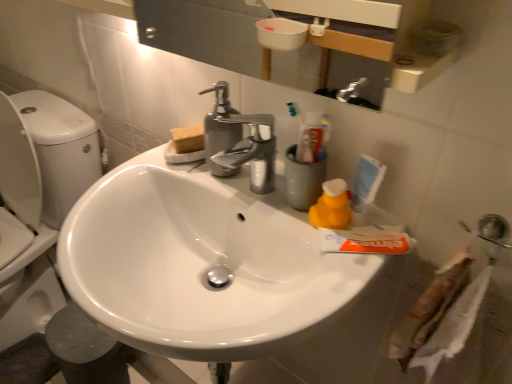
Question: Does white glossy sink at center lie behind yellow rubber duck at right?

Choices:
 (A) no
 (B) yes

Answer: (A)

Question: Does white glossy sink at center appear on the left side of yellow rubber duck at right?

Choices:
 (A) yes
 (B) no

Answer: (A)

Question: Can you confirm if white glossy sink at center is wider than yellow rubber duck at right?

Choices:
 (A) no
 (B) yes

Answer: (B)

Question: Can you confirm if white glossy sink at center is shorter than yellow rubber duck at right?

Choices:
 (A) yes
 (B) no

Answer: (B)

Question: Is white glossy sink at center smaller than yellow rubber duck at right?

Choices:
 (A) no
 (B) yes

Answer: (A)

Question: In terms of height, does yellow rubber duck at right look taller or shorter compared to white glossy sink at center?

Choices:
 (A) short
 (B) tall

Answer: (A)

Question: From a real-world perspective, relative to white glossy sink at center, is yellow rubber duck at right vertically above or below?

Choices:
 (A) below
 (B) above

Answer: (B)

Question: In the image, is yellow rubber duck at right positioned in front of or behind white glossy sink at center?

Choices:
 (A) front
 (B) behind

Answer: (B)

Question: Is point (335, 190) closer or farther from the camera than point (241, 213)?

Choices:
 (A) closer
 (B) farther

Answer: (A)

Question: Choose the correct answer: Is white matte toothpaste at center inside yellow rubber duck at right or outside it?

Choices:
 (A) outside
 (B) inside

Answer: (A)

Question: Is white matte toothpaste at center wider or thinner than yellow rubber duck at right?

Choices:
 (A) thin
 (B) wide

Answer: (B)

Question: Visually, is white matte toothpaste at center positioned to the left or to the right of yellow rubber duck at right?

Choices:
 (A) right
 (B) left

Answer: (A)

Question: Is white matte toothpaste at center in front of or behind yellow rubber duck at right in the image?

Choices:
 (A) front
 (B) behind

Answer: (A)

Question: Considering the positions of yellow rubber duck at right and metallic silver sink at lower right, acting as the 1th plumbing fixture starting from the right, in the image, is yellow rubber duck at right bigger or smaller than metallic silver sink at lower right, acting as the 1th plumbing fixture starting from the right,?

Choices:
 (A) small
 (B) big

Answer: (B)

Question: In the image, is yellow rubber duck at right positioned in front of or behind metallic silver sink at lower right, the 2th plumbing fixture viewed from the left?

Choices:
 (A) front
 (B) behind

Answer: (B)